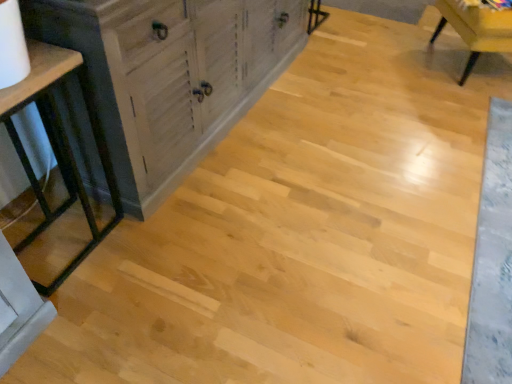
Question: Is distressed wood cabinet at left beside wooden chair at upper right?

Choices:
 (A) yes
 (B) no

Answer: (B)

Question: Is wooden chair at upper right at the back of distressed wood cabinet at left?

Choices:
 (A) yes
 (B) no

Answer: (B)

Question: Considering the relative sizes of distressed wood cabinet at left and wooden chair at upper right in the image provided, is distressed wood cabinet at left taller than wooden chair at upper right?

Choices:
 (A) no
 (B) yes

Answer: (B)

Question: Would you consider distressed wood cabinet at left to be distant from wooden chair at upper right?

Choices:
 (A) no
 (B) yes

Answer: (B)

Question: Would you say distressed wood cabinet at left is outside wooden chair at upper right?

Choices:
 (A) yes
 (B) no

Answer: (A)

Question: Is distressed wood cabinet at left at the right side of wooden chair at upper right?

Choices:
 (A) yes
 (B) no

Answer: (B)

Question: Is matte black table at left wider than distressed wood cabinet at left?

Choices:
 (A) yes
 (B) no

Answer: (B)

Question: Is matte black table at left not inside distressed wood cabinet at left?

Choices:
 (A) yes
 (B) no

Answer: (A)

Question: Can you confirm if matte black table at left is bigger than distressed wood cabinet at left?

Choices:
 (A) yes
 (B) no

Answer: (B)

Question: From the image's perspective, does matte black table at left appear lower than distressed wood cabinet at left?

Choices:
 (A) no
 (B) yes

Answer: (B)

Question: Is matte black table at left positioned with its back to distressed wood cabinet at left?

Choices:
 (A) yes
 (B) no

Answer: (B)

Question: Would you say matte black table at left is a long distance from distressed wood cabinet at left?

Choices:
 (A) yes
 (B) no

Answer: (B)

Question: Can you confirm if wooden chair at upper right is shorter than matte black table at left?

Choices:
 (A) no
 (B) yes

Answer: (B)